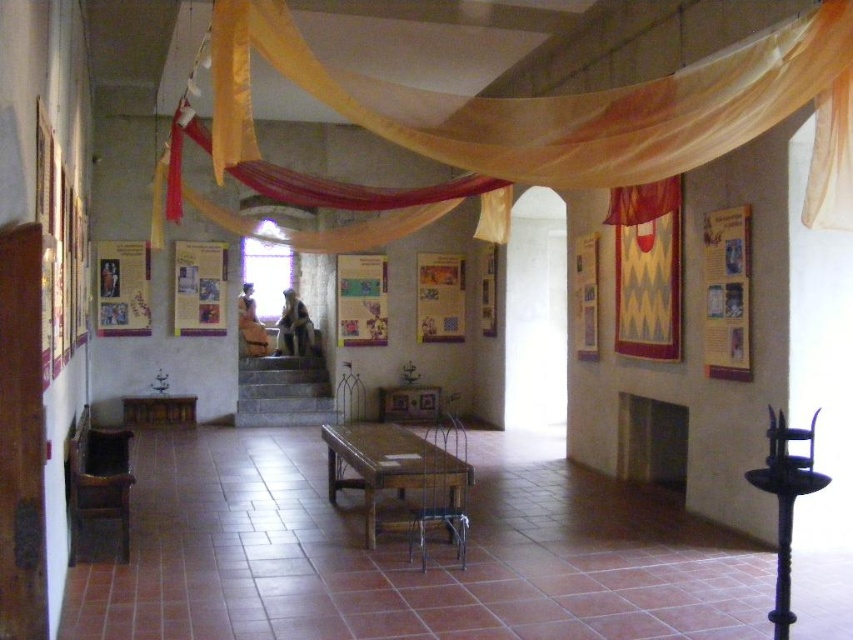
Question: Is translucent yellow fabric at upper center thinner than wooden table at center?

Choices:
 (A) no
 (B) yes

Answer: (A)

Question: Is translucent yellow fabric at upper center thinner than wooden table at center?

Choices:
 (A) no
 (B) yes

Answer: (A)

Question: Is translucent yellow fabric at upper center further to the viewer compared to wooden table at center?

Choices:
 (A) yes
 (B) no

Answer: (B)

Question: Which point is closer to the camera taking this photo?

Choices:
 (A) (332, 426)
 (B) (842, 184)

Answer: (B)